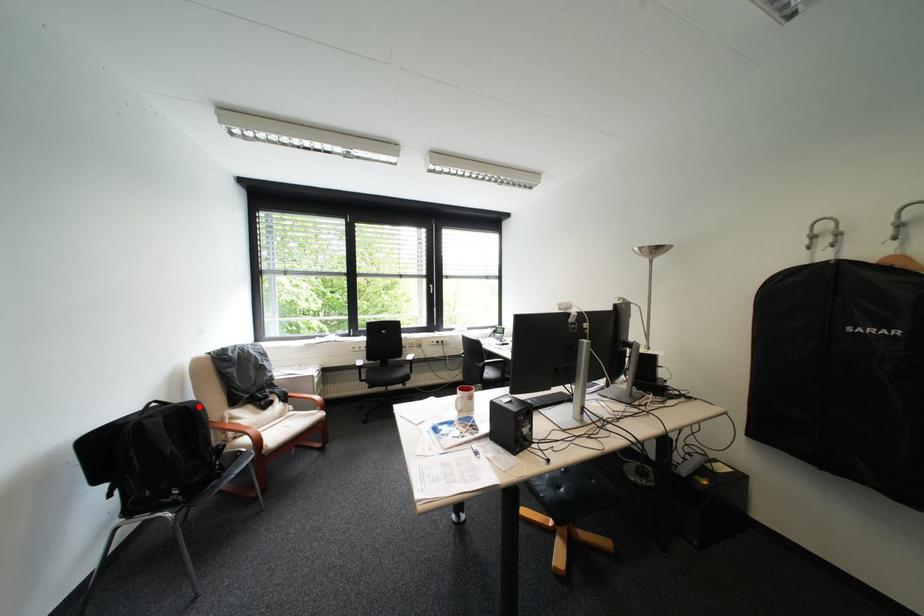
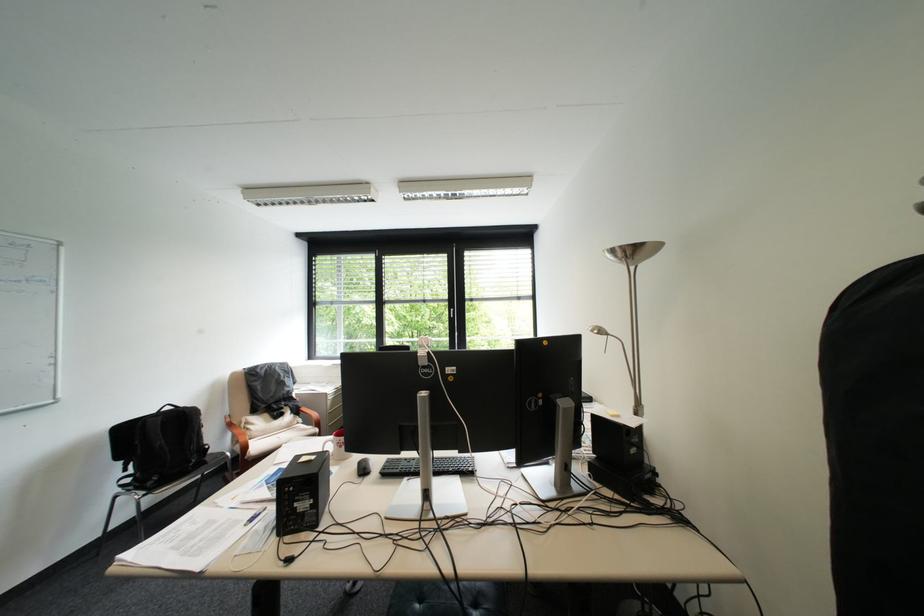
Locate, in the second image, the point that corresponds to the highlighted location in the first image.

(198, 411)